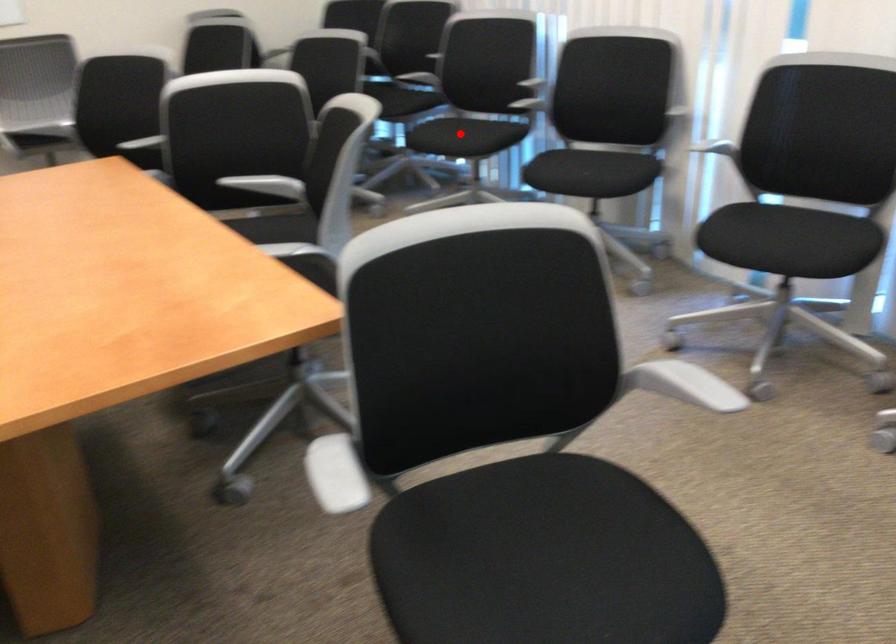
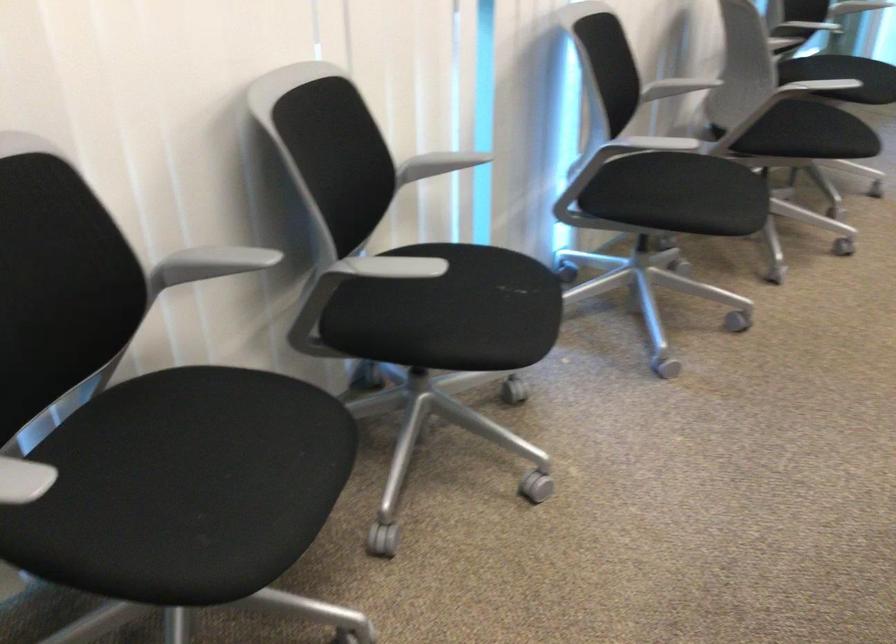
In the second image, find the point that corresponds to the highlighted location in the first image.

(226, 456)